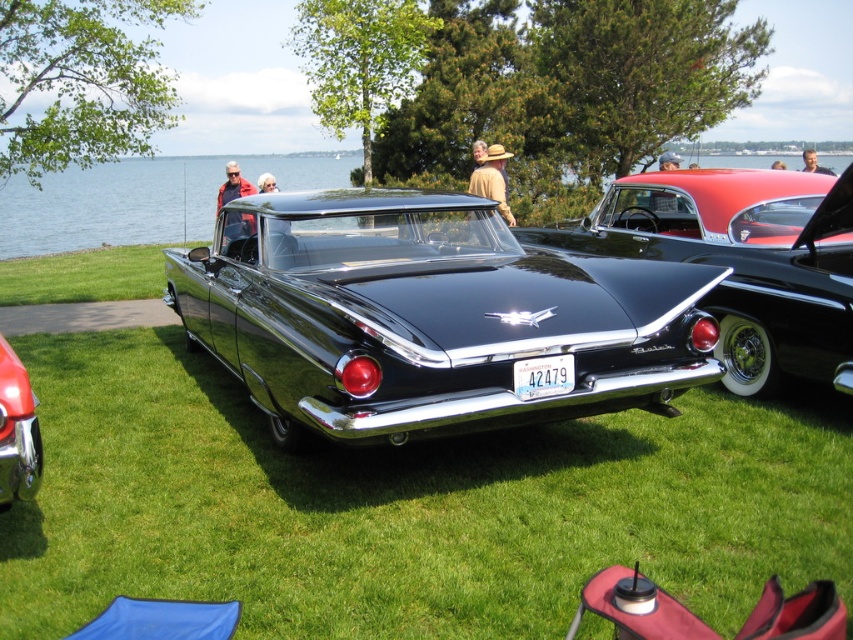
Question: Among these points, which one is nearest to the camera?

Choices:
 (A) (500, 305)
 (B) (20, 445)
 (C) (662, 211)

Answer: (B)

Question: Based on their relative distances, which object is farther from the glossy black car at center?

Choices:
 (A) shiny red car at lower left
 (B) black glossy car at center

Answer: (A)

Question: Is black glossy car at center thinner than glossy black car at center?

Choices:
 (A) no
 (B) yes

Answer: (A)

Question: Can you confirm if glossy black car at center is smaller than white plastic license plate at center?

Choices:
 (A) no
 (B) yes

Answer: (A)

Question: Among these objects, which one is farthest from the camera?

Choices:
 (A) shiny red car at lower left
 (B) glossy black car at center
 (C) black glossy car at center

Answer: (B)

Question: Does black glossy car at center lie behind shiny red car at lower left?

Choices:
 (A) yes
 (B) no

Answer: (A)